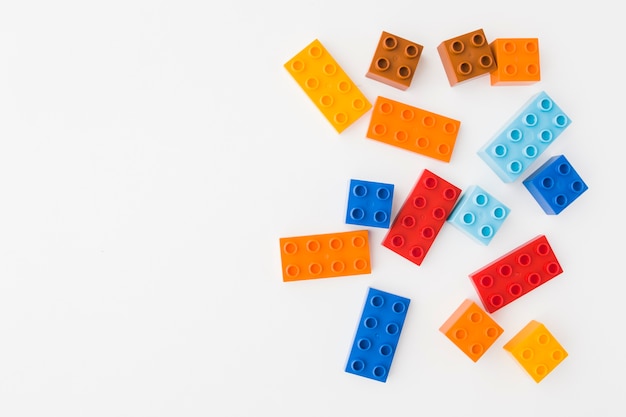
The height and width of the screenshot is (417, 626). In order to click on orange plastic building blocks in this screenshot , I will do `click(325, 250)`, `click(421, 126)`, `click(520, 60)`, `click(473, 331)`.